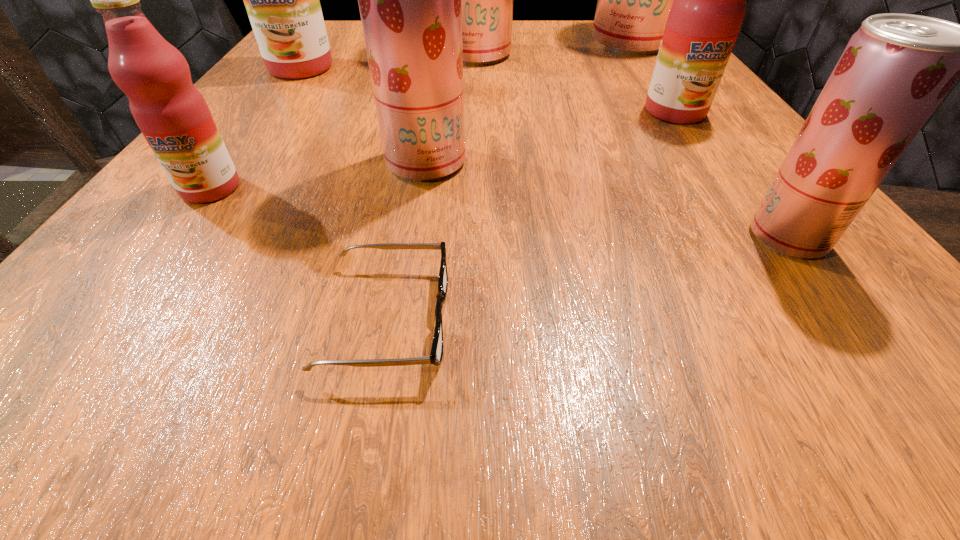
Find the location of a particular element. free point between the nearest pink fruit juice and the nearest fruit juice is located at coordinates (499, 213).

Identify the location of vacant point located between the spectacles and the nearest strawberry fruit juice. (588, 278).

Identify the location of free spot between the smallest strawberry fruit juice and the second nearest strawberry fruit juice. (607, 199).

Identify the location of blank region between the shortest object and the second smallest pink fruit juice. The height and width of the screenshot is (540, 960). (531, 215).

The width and height of the screenshot is (960, 540). I want to click on object that can be found as the sixth closest to the spectacles, so click(486, 0).

Identify the location of object that is the fifth closest to the second smallest strawberry fruit juice. Image resolution: width=960 pixels, height=540 pixels. (709, 6).

Point out which fruit juice is positioned as the fifth nearest to the biggest strawberry fruit juice. Please provide its 2D coordinates. Your answer should be formatted as a tuple, i.e. [(x, y)], where the tuple contains the x and y coordinates of a point satisfying the conditions above.

[(282, 0)]

This screenshot has height=540, width=960. Identify the location of fruit juice identified as the second closest to the nearest pink fruit juice. (282, 0).

In order to click on strawberry fruit juice that is the third closest to the second smallest strawberry fruit juice in this screenshot , I will do `click(634, 0)`.

Where is `the fourth closest strawberry fruit juice to the black spectacles`? the fourth closest strawberry fruit juice to the black spectacles is located at coordinates (634, 0).